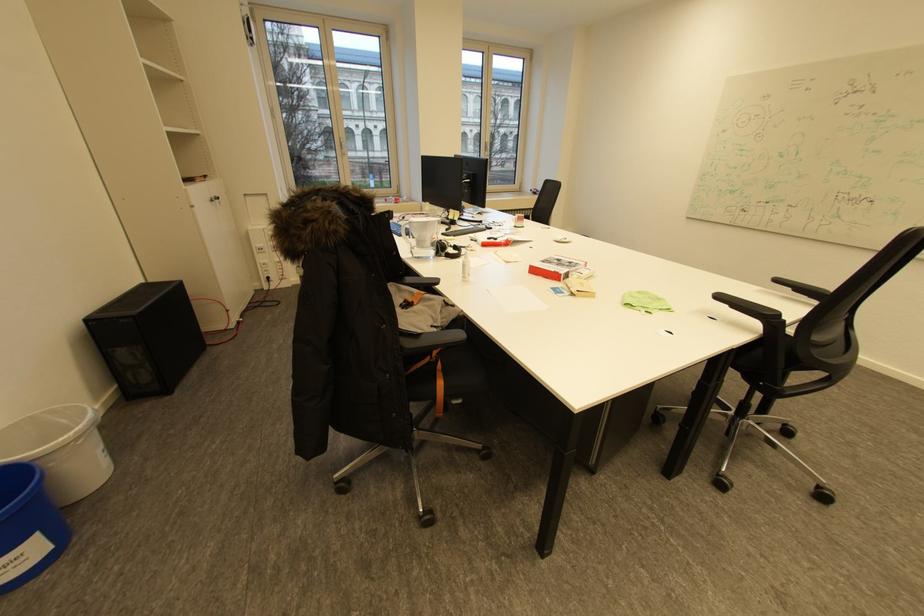
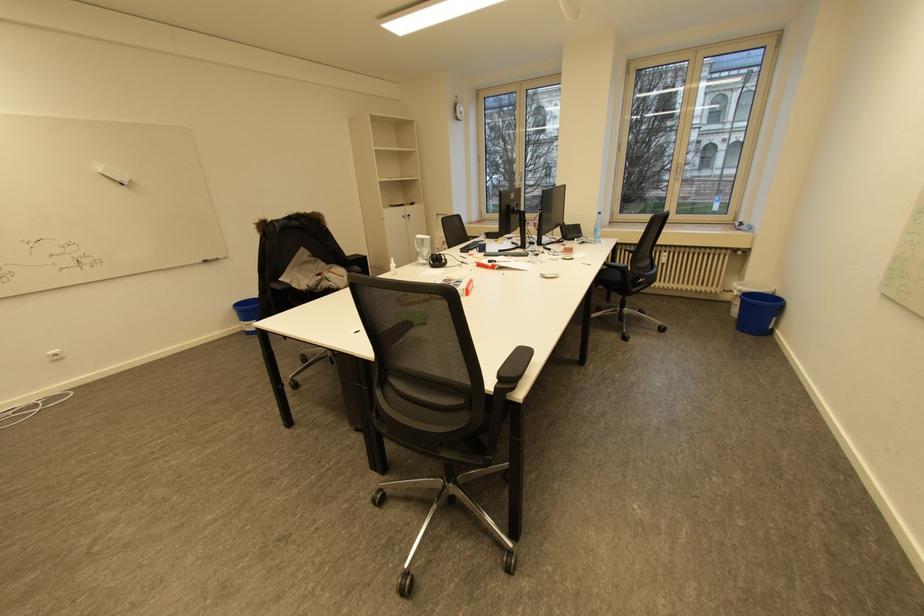
Question: I am providing you with two images of the same scene from different viewpoints. After the viewpoint changes to image2, which objects are now occluded?

Choices:
 (A) lamp head
 (B) blue plastic bin
 (C) black headphones
 (D) cabinet door handle

Answer: (C)